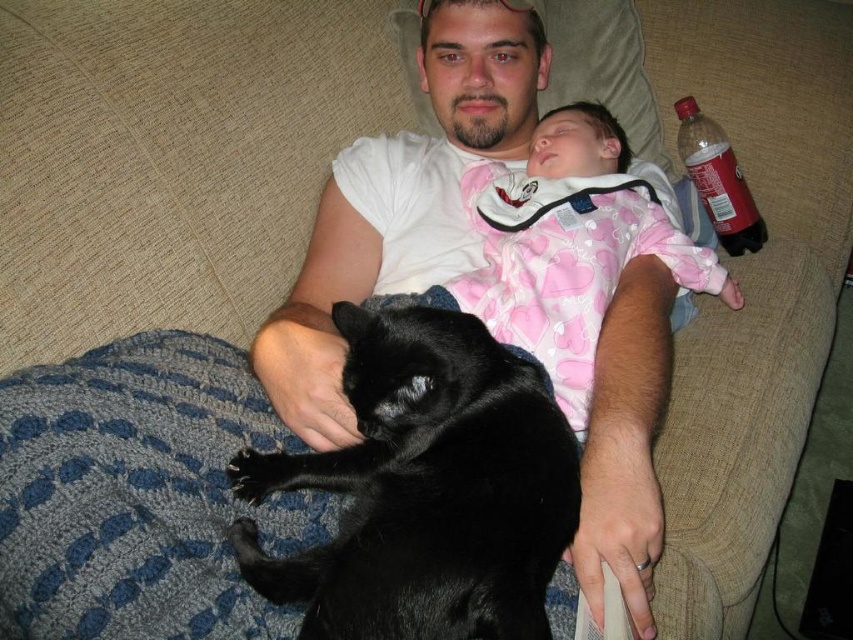
You are a photographer taking a picture of the shiny black cat at center and the pink cotton onesie at upper center. Which object should you focus on first to ensure both are in sharp focus?

The shiny black cat at center is in front of the pink cotton onesie at upper center, so you should focus on the shiny black cat at center first to ensure both are in sharp focus.

Consider the image. A man is sitting on a couch with a baby and a cat. There is a red point at position (368, 387). If the man wants to reach the red point, can he do it without moving from his current position?

The man and the red point are 83.83 centimeters apart. Since the average arm length of an adult male is about 70 centimeters, the man may not be able to reach the red point without moving from his current position.

Based on the coordinates provided, where is the pink cotton onesie at upper center located in the image?

The pink cotton onesie at upper center is located at coordinates point (569, 244).